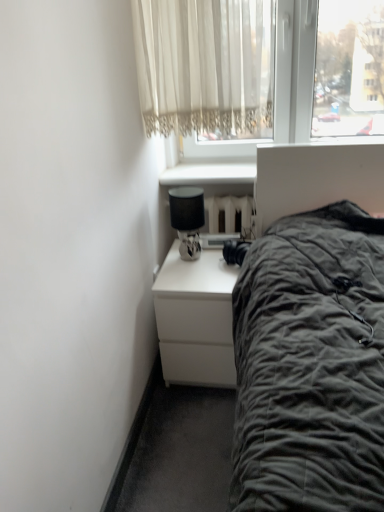
Identify the location of vacant space in front of matte black lamp at upper right. The width and height of the screenshot is (384, 512). (194, 274).